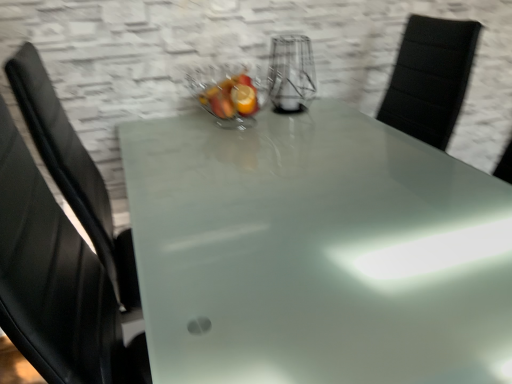
Question: Is frosted glass table at center further to camera compared to clear glass vase at center?

Choices:
 (A) yes
 (B) no

Answer: (B)

Question: Is frosted glass table at center oriented away from clear glass vase at center?

Choices:
 (A) no
 (B) yes

Answer: (A)

Question: Does frosted glass table at center have a larger size compared to clear glass vase at center?

Choices:
 (A) no
 (B) yes

Answer: (B)

Question: Does frosted glass table at center appear on the left side of clear glass vase at center?

Choices:
 (A) no
 (B) yes

Answer: (A)

Question: Can we say frosted glass table at center lies outside clear glass vase at center?

Choices:
 (A) no
 (B) yes

Answer: (B)

Question: Can you confirm if frosted glass table at center is positioned to the right of clear glass vase at center?

Choices:
 (A) yes
 (B) no

Answer: (A)

Question: Is clear glass bowl at center inside frosted glass table at center?

Choices:
 (A) yes
 (B) no

Answer: (B)

Question: From a real-world perspective, is frosted glass table at center physically below clear glass bowl at center?

Choices:
 (A) no
 (B) yes

Answer: (B)

Question: Is frosted glass table at center bigger than clear glass bowl at center?

Choices:
 (A) no
 (B) yes

Answer: (B)

Question: Can you confirm if frosted glass table at center is positioned to the left of clear glass bowl at center?

Choices:
 (A) yes
 (B) no

Answer: (B)

Question: From the image's perspective, is frosted glass table at center over clear glass bowl at center?

Choices:
 (A) no
 (B) yes

Answer: (A)

Question: Can you confirm if frosted glass table at center is shorter than clear glass bowl at center?

Choices:
 (A) no
 (B) yes

Answer: (A)

Question: From a real-world perspective, does clear glass bowl at center sit lower than clear glass vase at center?

Choices:
 (A) no
 (B) yes

Answer: (B)